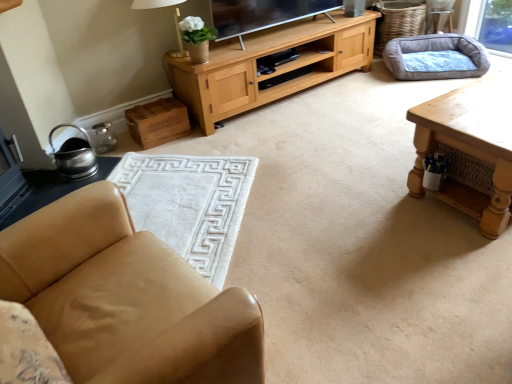
Question: Considering the relative positions of gray fabric dog bed at upper right and white soft rug at lower left in the image provided, is gray fabric dog bed at upper right to the right of white soft rug at lower left from the viewer's perspective?

Choices:
 (A) no
 (B) yes

Answer: (B)

Question: From the image's perspective, is gray fabric dog bed at upper right above white soft rug at lower left?

Choices:
 (A) yes
 (B) no

Answer: (A)

Question: Is gray fabric dog bed at upper right looking in the opposite direction of white soft rug at lower left?

Choices:
 (A) no
 (B) yes

Answer: (A)

Question: Is gray fabric dog bed at upper right outside of white soft rug at lower left?

Choices:
 (A) no
 (B) yes

Answer: (B)

Question: From a real-world perspective, is gray fabric dog bed at upper right positioned under white soft rug at lower left based on gravity?

Choices:
 (A) no
 (B) yes

Answer: (A)

Question: Does gray fabric dog bed at upper right contain white soft rug at lower left?

Choices:
 (A) no
 (B) yes

Answer: (A)

Question: From the image's perspective, is light brown leather armchair at upper right on tan leather chair at lower left?

Choices:
 (A) yes
 (B) no

Answer: (A)

Question: Is the depth of light brown leather armchair at upper right greater than that of tan leather chair at lower left?

Choices:
 (A) no
 (B) yes

Answer: (B)

Question: Are light brown leather armchair at upper right and tan leather chair at lower left making contact?

Choices:
 (A) yes
 (B) no

Answer: (B)

Question: From a real-world perspective, is light brown leather armchair at upper right located beneath tan leather chair at lower left?

Choices:
 (A) yes
 (B) no

Answer: (A)

Question: Would you say light brown leather armchair at upper right is a long distance from tan leather chair at lower left?

Choices:
 (A) yes
 (B) no

Answer: (A)

Question: Does light brown leather armchair at upper right have a smaller size compared to tan leather chair at lower left?

Choices:
 (A) yes
 (B) no

Answer: (A)

Question: Considering the relative positions of white fabric lampshade at upper center and light brown leather armchair at upper right in the image provided, is white fabric lampshade at upper center to the right of light brown leather armchair at upper right from the viewer's perspective?

Choices:
 (A) no
 (B) yes

Answer: (A)